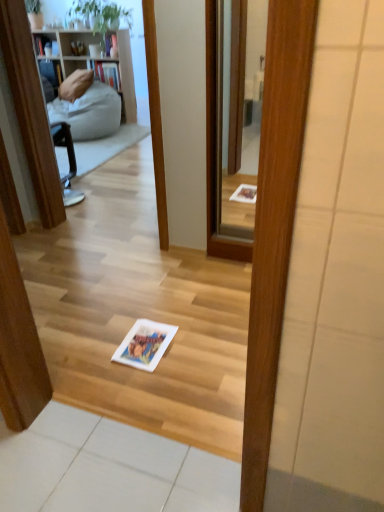
Question: From the image's perspective, relative to clear glass mirror at center, is white paper book at center above or below?

Choices:
 (A) above
 (B) below

Answer: (B)

Question: In terms of height, does white paper book at center look taller or shorter compared to clear glass mirror at center?

Choices:
 (A) short
 (B) tall

Answer: (A)

Question: Considering the positions of point [165, 346] and point [221, 187], is point [165, 346] closer or farther from the camera than point [221, 187]?

Choices:
 (A) closer
 (B) farther

Answer: (A)

Question: From the image's perspective, is clear glass mirror at center located above or below white paper book at center?

Choices:
 (A) below
 (B) above

Answer: (B)

Question: In the image, is clear glass mirror at center positioned in front of or behind white paper book at center?

Choices:
 (A) behind
 (B) front

Answer: (A)

Question: Would you say clear glass mirror at center is to the left or to the right of white paper book at center in the picture?

Choices:
 (A) left
 (B) right

Answer: (B)

Question: Considering the positions of clear glass mirror at center and white paper book at center in the image, is clear glass mirror at center taller or shorter than white paper book at center?

Choices:
 (A) tall
 (B) short

Answer: (A)